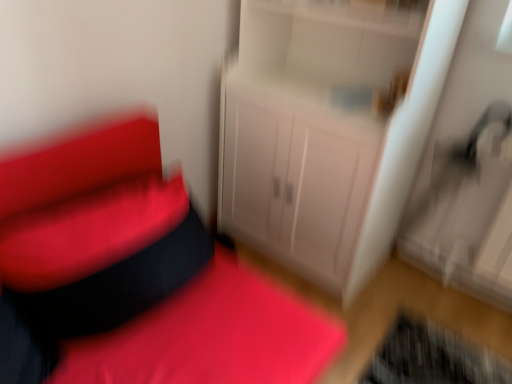
Question: Considering the relative sizes of metallic silver swivel chair at right and matte white cabinet at center in the image provided, is metallic silver swivel chair at right taller than matte white cabinet at center?

Choices:
 (A) yes
 (B) no

Answer: (A)

Question: Is matte white cabinet at center inside metallic silver swivel chair at right?

Choices:
 (A) no
 (B) yes

Answer: (A)

Question: From a real-world perspective, is metallic silver swivel chair at right physically above matte white cabinet at center?

Choices:
 (A) yes
 (B) no

Answer: (A)

Question: Does metallic silver swivel chair at right have a lesser height compared to matte white cabinet at center?

Choices:
 (A) yes
 (B) no

Answer: (B)

Question: From the image's perspective, is metallic silver swivel chair at right located beneath matte white cabinet at center?

Choices:
 (A) yes
 (B) no

Answer: (B)

Question: From their relative heights in the image, would you say matte white cabinet at center is taller or shorter than white glossy cabinet at center?

Choices:
 (A) short
 (B) tall

Answer: (A)

Question: Is matte white cabinet at center to the left or to the right of white glossy cabinet at center in the image?

Choices:
 (A) right
 (B) left

Answer: (B)

Question: From a real-world perspective, is matte white cabinet at center positioned above or below white glossy cabinet at center?

Choices:
 (A) below
 (B) above

Answer: (A)

Question: Considering the positions of matte white cabinet at center and white glossy cabinet at center in the image, is matte white cabinet at center wider or thinner than white glossy cabinet at center?

Choices:
 (A) thin
 (B) wide

Answer: (B)

Question: Considering the positions of point (264, 82) and point (161, 369), is point (264, 82) closer or farther from the camera than point (161, 369)?

Choices:
 (A) closer
 (B) farther

Answer: (B)

Question: Based on their sizes in the image, would you say white glossy cabinet at center is bigger or smaller than matte white cabinet at center?

Choices:
 (A) big
 (B) small

Answer: (B)

Question: From the image's perspective, relative to matte white cabinet at center, is white glossy cabinet at center above or below?

Choices:
 (A) below
 (B) above

Answer: (B)

Question: From a real-world perspective, is white glossy cabinet at center physically located above or below matte white cabinet at center?

Choices:
 (A) above
 (B) below

Answer: (A)

Question: Is point (414, 218) positioned closer to the camera than point (10, 248)?

Choices:
 (A) farther
 (B) closer

Answer: (A)

Question: Is metallic silver swivel chair at right in front of or behind matte white cabinet at center in the image?

Choices:
 (A) behind
 (B) front

Answer: (A)